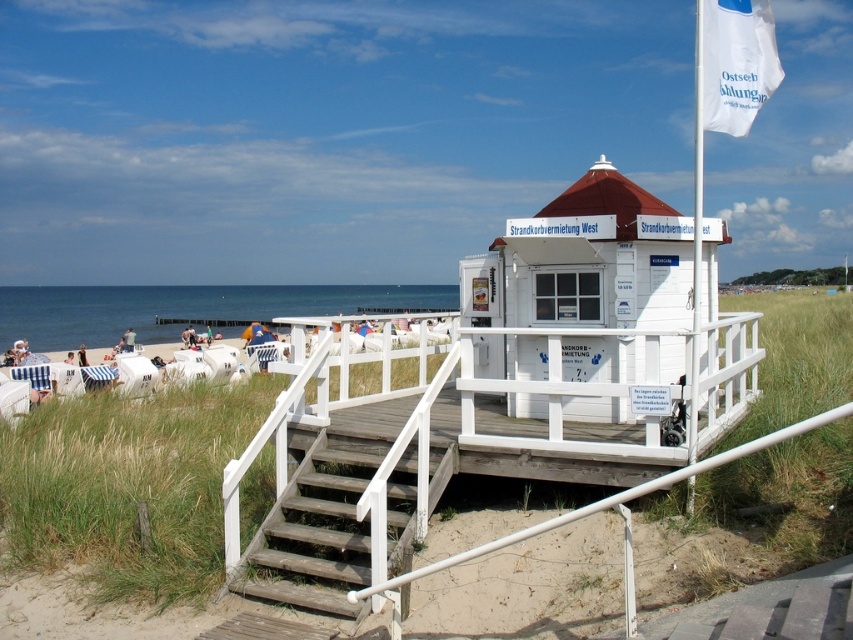
You are a tourist planning to set up a small stand near the white wooden beach hut at center and the wooden stairs at center. Since you want your stand to be as visible as possible, which location should you choose based on their sizes?

The white wooden beach hut at center is bigger than the wooden stairs at center, so placing your stand near the white wooden beach hut at center would make it more visible due to its larger size.

You are a tourist on the beach and want to find the beach chair rental location. You see the white wooden beach hut at center and the white fabric flag at upper right. According to the scene, which object is positioned higher up in the image?

The white fabric flag at upper right is positioned higher up in the image than the white wooden beach hut at center.

You are a tourist who just arrived at the beach and see the white wooden beach hut at center and the white fabric flag at upper right. Which object is closer to the left side of the image?

The white wooden beach hut at center is closer to the left side of the image than the white fabric flag at upper right.